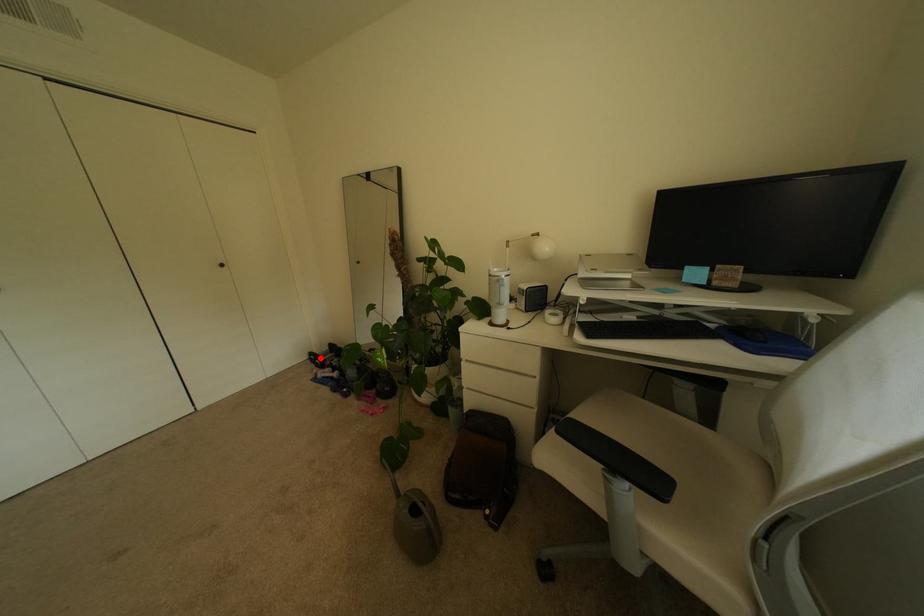
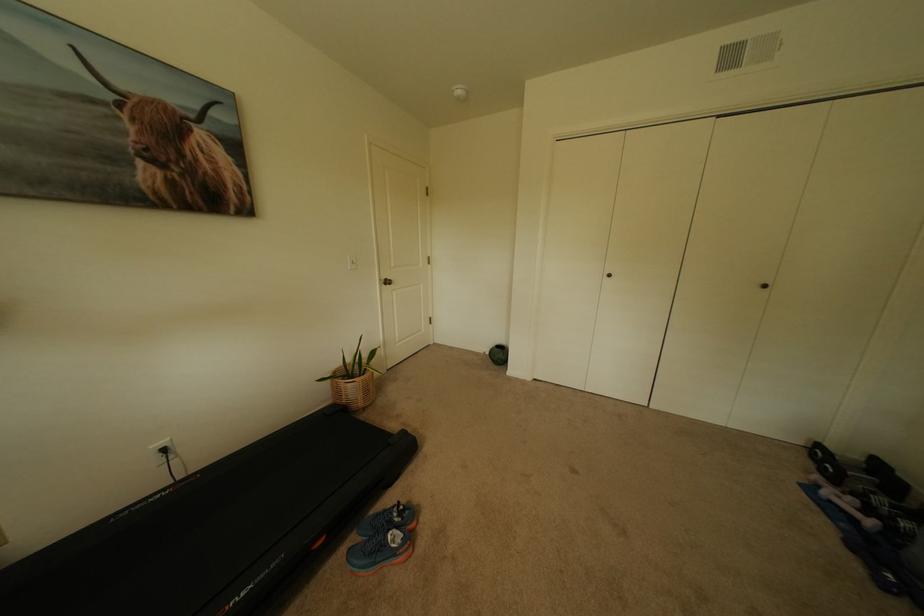
The point at the highlighted location is marked in the first image. Where is the corresponding point in the second image?

(827, 452)